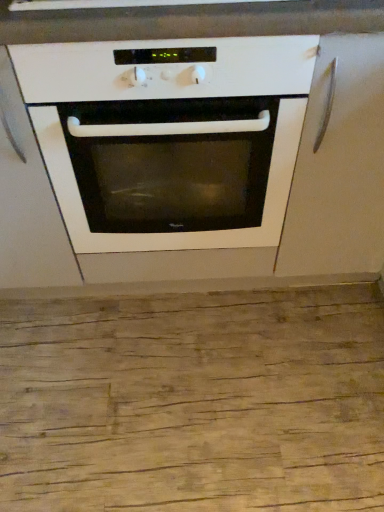
Question: In terms of size, does white glossy oven at center appear bigger or smaller than white matte cabinet at center, arranged as the 2th cabinetry when viewed from the right?

Choices:
 (A) small
 (B) big

Answer: (B)

Question: Is white glossy oven at center in front of or behind white matte cabinet at center, the first cabinetry from the left, in the image?

Choices:
 (A) front
 (B) behind

Answer: (A)

Question: Estimate the real-world distances between objects in this image. Which object is closer to the matte white cabinet at right, the first cabinetry from the right?

Choices:
 (A) white glossy oven at center
 (B) white matte cabinet at center, the first cabinetry from the left

Answer: (A)

Question: Estimate the real-world distances between objects in this image. Which object is farther from the matte white cabinet at right, which is the second cabinetry in left-to-right order?

Choices:
 (A) white glossy oven at center
 (B) white matte cabinet at center, arranged as the 2th cabinetry when viewed from the right

Answer: (B)